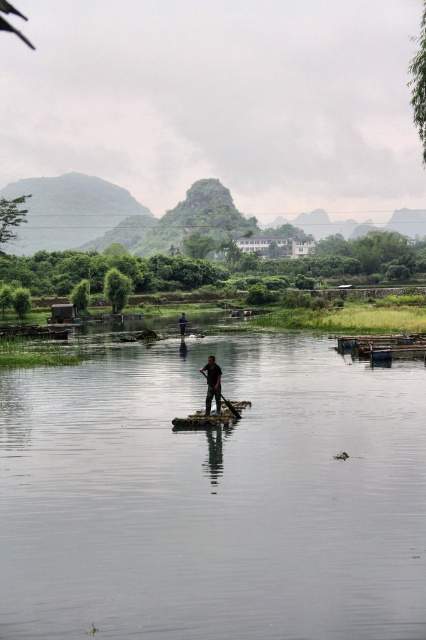
Question: Which is farther from the dark blue fabric at center?

Choices:
 (A) clear water at center
 (B) wooden paddle at center

Answer: (A)

Question: Does clear water at center have a lesser width compared to wooden raft at center?

Choices:
 (A) no
 (B) yes

Answer: (A)

Question: Which is farther from the wooden raft at center?

Choices:
 (A) dark blue fabric at center
 (B) dark green fabric at center
 (C) wooden paddle at center

Answer: (B)

Question: Is dark blue fabric at center to the left of dark green fabric at center from the viewer's perspective?

Choices:
 (A) yes
 (B) no

Answer: (B)

Question: Is dark blue fabric at center further to the viewer compared to wooden paddle at center?

Choices:
 (A) no
 (B) yes

Answer: (A)

Question: Which point is closer to the camera taking this photo?

Choices:
 (A) (183, 314)
 (B) (224, 397)
 (C) (311, 595)

Answer: (C)